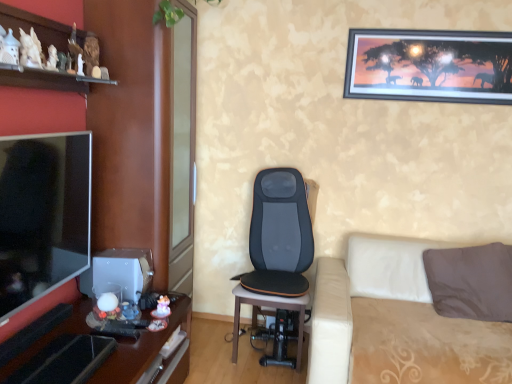
Find the location of a particular element. This screenshot has height=384, width=512. free location above wooden glossy desk at left (from a real-world perspective) is located at coordinates (113, 334).